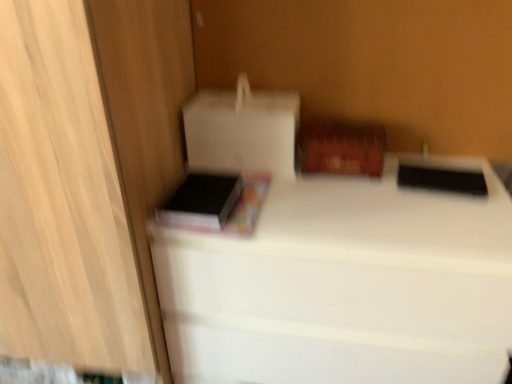
Question: Does white matte bed at center appear on the left side of white matte cardboard box at upper left, which is counted as the first cardboard box, starting from the left?

Choices:
 (A) no
 (B) yes

Answer: (A)

Question: From a real-world perspective, is white matte bed at center located higher than white matte cardboard box at upper left, marked as the 2th cardboard box in a right-to-left arrangement?

Choices:
 (A) no
 (B) yes

Answer: (A)

Question: Considering the relative sizes of white matte bed at center and white matte cardboard box at upper left, which is counted as the first cardboard box, starting from the left, in the image provided, is white matte bed at center taller than white matte cardboard box at upper left, which is counted as the first cardboard box, starting from the left,?

Choices:
 (A) no
 (B) yes

Answer: (B)

Question: From a real-world perspective, is white matte bed at center beneath white matte cardboard box at upper left, which is counted as the first cardboard box, starting from the left?

Choices:
 (A) no
 (B) yes

Answer: (B)

Question: Does white matte bed at center have a greater width compared to white matte cardboard box at upper left, marked as the 2th cardboard box in a right-to-left arrangement?

Choices:
 (A) yes
 (B) no

Answer: (A)

Question: Is point (302, 132) positioned closer to the camera than point (245, 147)?

Choices:
 (A) closer
 (B) farther

Answer: (B)

Question: Considering the positions of cardboard box at upper right, marked as the 1th cardboard box in a right-to-left arrangement, and white matte cardboard box at upper left, marked as the 2th cardboard box in a right-to-left arrangement, in the image, is cardboard box at upper right, marked as the 1th cardboard box in a right-to-left arrangement, taller or shorter than white matte cardboard box at upper left, marked as the 2th cardboard box in a right-to-left arrangement,?

Choices:
 (A) tall
 (B) short

Answer: (B)

Question: In the image, is cardboard box at upper right, the 2th cardboard box viewed from the left, positioned in front of or behind white matte cardboard box at upper left, which is counted as the first cardboard box, starting from the left?

Choices:
 (A) front
 (B) behind

Answer: (B)

Question: Based on their sizes in the image, would you say cardboard box at upper right, marked as the 1th cardboard box in a right-to-left arrangement, is bigger or smaller than white matte cardboard box at upper left, marked as the 2th cardboard box in a right-to-left arrangement?

Choices:
 (A) big
 (B) small

Answer: (B)

Question: Relative to white matte bed at center, is white matte cardboard box at upper left, which is counted as the first cardboard box, starting from the left, in front or behind?

Choices:
 (A) front
 (B) behind

Answer: (B)

Question: Would you say white matte cardboard box at upper left, marked as the 2th cardboard box in a right-to-left arrangement, is to the left or to the right of white matte bed at center in the picture?

Choices:
 (A) left
 (B) right

Answer: (A)

Question: From the image's perspective, relative to white matte bed at center, is white matte cardboard box at upper left, marked as the 2th cardboard box in a right-to-left arrangement, above or below?

Choices:
 (A) above
 (B) below

Answer: (A)

Question: Considering the positions of white matte cardboard box at upper left, marked as the 2th cardboard box in a right-to-left arrangement, and white matte bed at center in the image, is white matte cardboard box at upper left, marked as the 2th cardboard box in a right-to-left arrangement, wider or thinner than white matte bed at center?

Choices:
 (A) wide
 (B) thin

Answer: (B)

Question: Is black matte book at left situated inside white matte cardboard box at upper left, marked as the 2th cardboard box in a right-to-left arrangement, or outside?

Choices:
 (A) outside
 (B) inside

Answer: (A)

Question: Is black matte book at left in front of or behind white matte cardboard box at upper left, marked as the 2th cardboard box in a right-to-left arrangement, in the image?

Choices:
 (A) front
 (B) behind

Answer: (A)